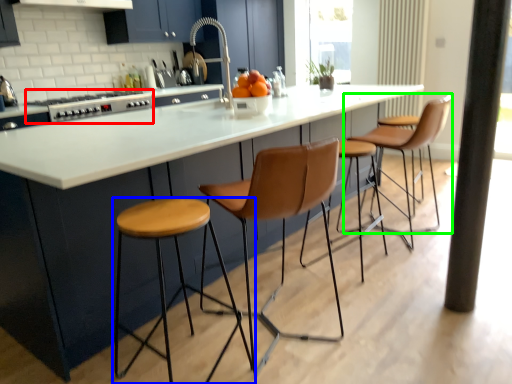
Question: Considering the real-world distances, which object is farthest from appliance (highlighted by a red box)? stool (highlighted by a blue box) or chair (highlighted by a green box)?

Choices:
 (A) stool
 (B) chair

Answer: (B)